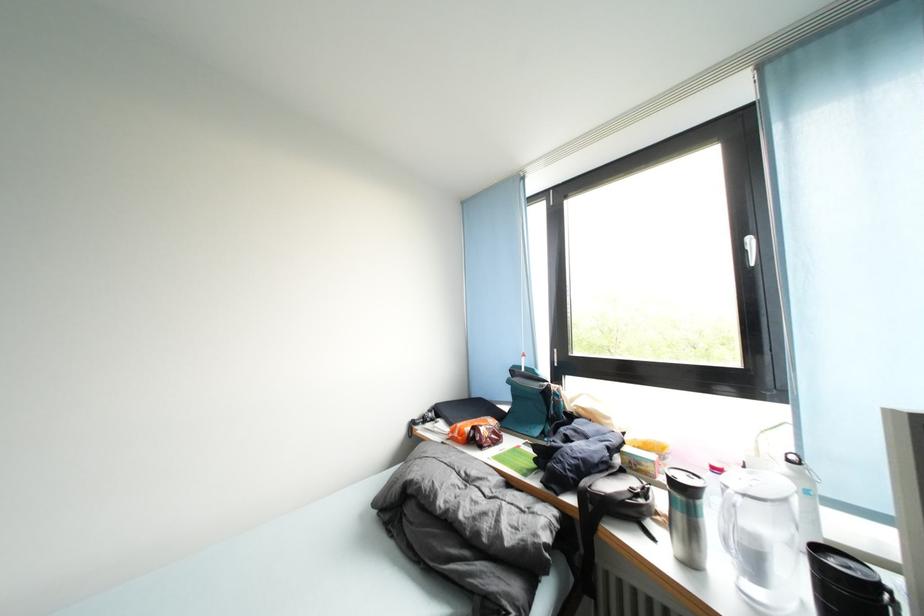
Where would you pull the blind control wand? Please return your answer as a coordinate pair (x, y).

(523, 359)